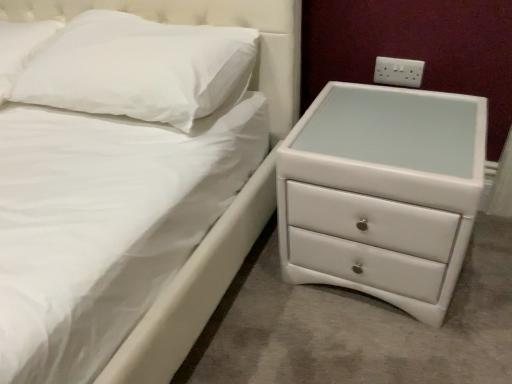
Question: Is white matte pillow at upper left, which is counted as the 1th pillow, starting from the left, located outside white glossy chest of drawers at right?

Choices:
 (A) no
 (B) yes

Answer: (B)

Question: Is white matte pillow at upper left, which is counted as the 1th pillow, starting from the left, shorter than white glossy chest of drawers at right?

Choices:
 (A) no
 (B) yes

Answer: (B)

Question: Considering the relative positions of white matte pillow at upper left, which is counted as the 1th pillow, starting from the left, and white glossy chest of drawers at right in the image provided, is white matte pillow at upper left, which is counted as the 1th pillow, starting from the left, to the left of white glossy chest of drawers at right from the viewer's perspective?

Choices:
 (A) no
 (B) yes

Answer: (B)

Question: Does white matte pillow at upper left, arranged as the 2th pillow when viewed from the right, come behind white glossy chest of drawers at right?

Choices:
 (A) no
 (B) yes

Answer: (B)

Question: Is white matte pillow at upper left, arranged as the 2th pillow when viewed from the right, wider than white glossy chest of drawers at right?

Choices:
 (A) no
 (B) yes

Answer: (A)

Question: Does point (185, 94) appear closer or farther from the camera than point (31, 23)?

Choices:
 (A) farther
 (B) closer

Answer: (B)

Question: From the image's perspective, relative to white matte pillow at upper left, arranged as the 2th pillow when viewed from the right, is white soft pillow at upper left, which is the first pillow in right-to-left order, above or below?

Choices:
 (A) above
 (B) below

Answer: (B)

Question: In the image, is white soft pillow at upper left, marked as the second pillow in a left-to-right arrangement, positioned in front of or behind white matte pillow at upper left, arranged as the 2th pillow when viewed from the right?

Choices:
 (A) front
 (B) behind

Answer: (A)

Question: Choose the correct answer: Is white soft pillow at upper left, which is the first pillow in right-to-left order, inside white matte pillow at upper left, arranged as the 2th pillow when viewed from the right, or outside it?

Choices:
 (A) outside
 (B) inside

Answer: (A)

Question: Considering the positions of white glossy chest of drawers at right and white matte pillow at upper left, arranged as the 2th pillow when viewed from the right, in the image, is white glossy chest of drawers at right wider or thinner than white matte pillow at upper left, arranged as the 2th pillow when viewed from the right,?

Choices:
 (A) wide
 (B) thin

Answer: (A)

Question: From their relative heights in the image, would you say white glossy chest of drawers at right is taller or shorter than white matte pillow at upper left, which is counted as the 1th pillow, starting from the left?

Choices:
 (A) short
 (B) tall

Answer: (B)

Question: Visually, is white glossy chest of drawers at right positioned to the left or to the right of white matte pillow at upper left, which is counted as the 1th pillow, starting from the left?

Choices:
 (A) left
 (B) right

Answer: (B)

Question: From a real-world perspective, is white glossy chest of drawers at right positioned above or below white matte pillow at upper left, arranged as the 2th pillow when viewed from the right?

Choices:
 (A) above
 (B) below

Answer: (B)

Question: Choose the correct answer: Is white plastic electrical outlet at upper right inside white glossy chest of drawers at right or outside it?

Choices:
 (A) outside
 (B) inside

Answer: (A)

Question: Looking at their shapes, would you say white plastic electrical outlet at upper right is wider or thinner than white glossy chest of drawers at right?

Choices:
 (A) thin
 (B) wide

Answer: (A)